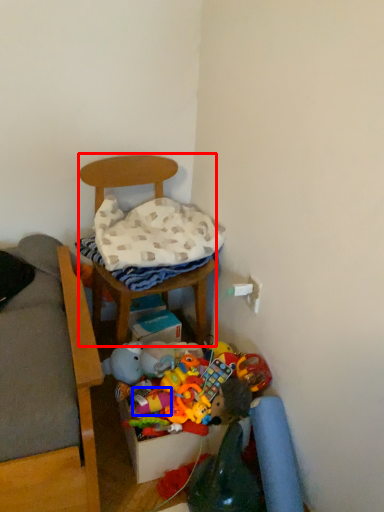
Question: Which of the following is the farthest to the observer, furniture (highlighted by a red box) or toy (highlighted by a blue box)?

Choices:
 (A) furniture
 (B) toy

Answer: (B)